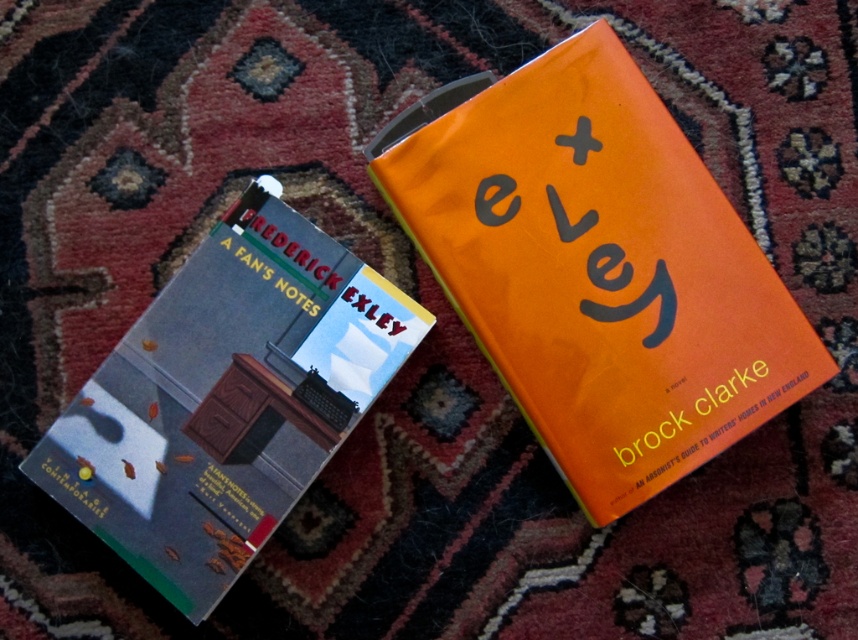
You are organizing books on a shelf and need to place the orange matte book at upper right and the hardcover book at left. According to their positions in the image, which book should be placed to the right side of the shelf?

The orange matte book at upper right should be placed to the right side of the shelf because it is positioned to the right of the hardcover book at left in the image.

You are organizing a bookshelf and need to place both the orange matte book at upper right and the hardcover book at left. What is the minimum distance you need to leave between them to ensure they are properly spaced?

The minimum distance you need to leave between the orange matte book at upper right and the hardcover book at left is 10.78 inches to ensure proper spacing.